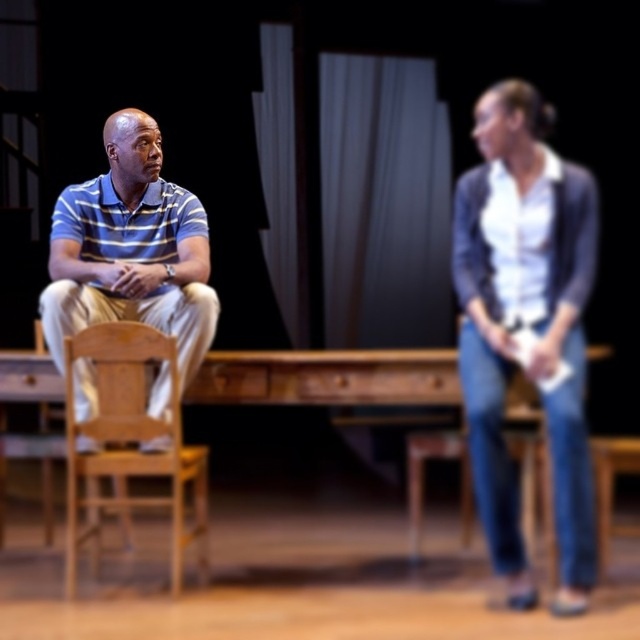
You are a stagehand responsible for moving the wooden chair at left closer to the white fabric curtain at center. The stage manager requires the chair to be placed exactly 2 meters away from the curtain. Can you achieve this using the current setup?

The current distance between wooden chair at left and white fabric curtain at center is 3.29 meters. To meet the stage manager requirement of 2 meters, the chair needs to be moved closer by 1.29 meters. This adjustment is possible within the current setup.

You are designing costumes for a play and need to ensure that the white cotton shirt at right and the striped polo shirt at left are proportionate. Which shirt has a greater width?

The striped polo shirt at left has a greater width than the white cotton shirt at right, as stated in the description.

You are an audience member sitting in the front row of the theater. You notice two characters on stage wearing a white cotton shirt at right and a striped polo shirt at left. Which character is standing farther to the right side of the stage?

The white cotton shirt at right is positioned on the right side of the striped polo shirt at left, so the character wearing the white cotton shirt at right is standing farther to the right side of the stage.